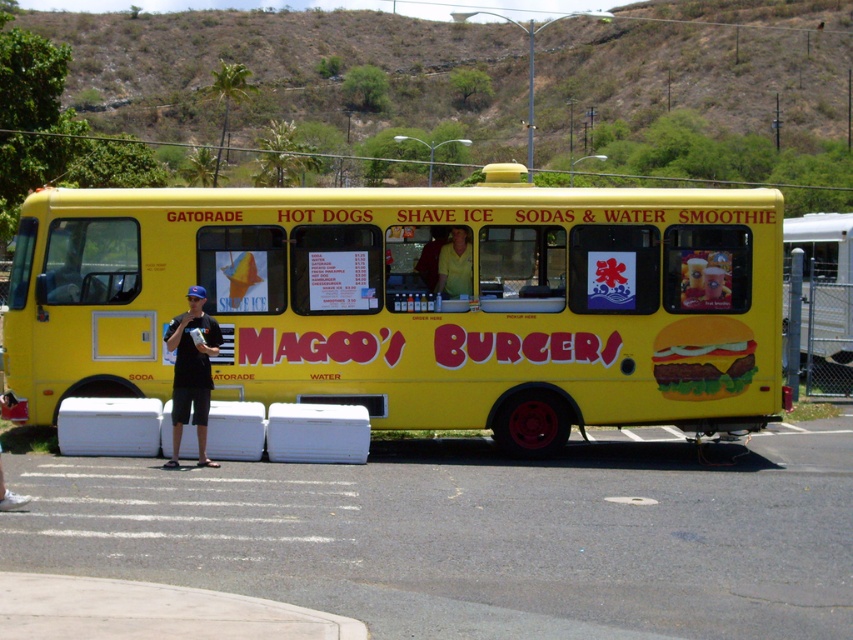
Question: Considering the real-world distances, which object is closest to the black cotton t-shirt at lower left?

Choices:
 (A) yellow matte shirt at center
 (B) yellow matte food truck at center
 (C) yellow matte hamburger at center
 (D) concrete at lower left

Answer: (B)

Question: Does yellow matte hamburger at center have a larger size compared to yellow matte shirt at center?

Choices:
 (A) no
 (B) yes

Answer: (B)

Question: Among these points, which one is nearest to the camera?

Choices:
 (A) (457, 269)
 (B) (468, 312)
 (C) (96, 579)

Answer: (C)

Question: Is yellow matte food truck at center bigger than yellow matte shirt at center?

Choices:
 (A) no
 (B) yes

Answer: (A)

Question: Is concrete at lower left wider than black cotton t-shirt at lower left?

Choices:
 (A) no
 (B) yes

Answer: (B)

Question: Which of these objects is positioned farthest from the yellow matte food truck at center?

Choices:
 (A) yellow matte hamburger at center
 (B) black cotton t-shirt at lower left

Answer: (A)